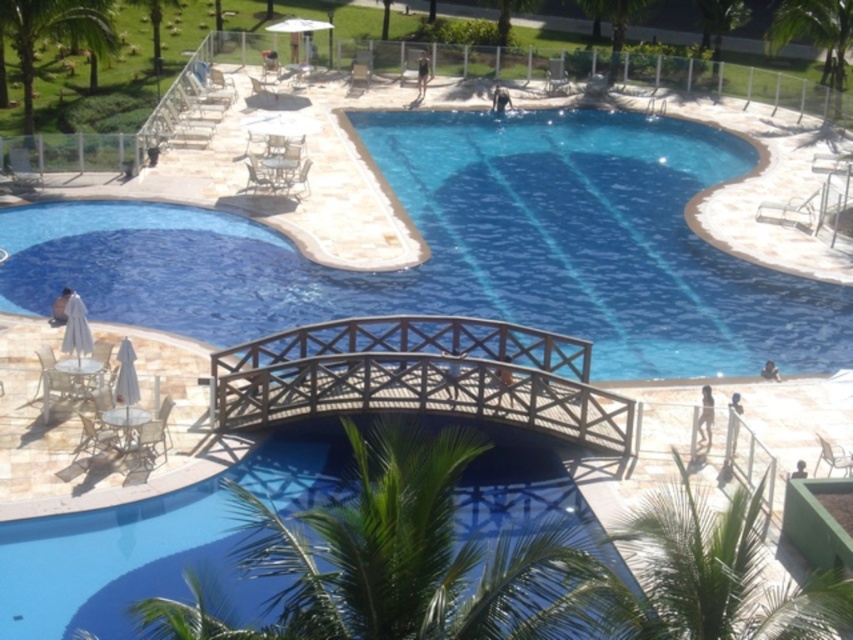
Question: Is green leafy palm tree at center further to the viewer compared to metallic silver chair at lower right?

Choices:
 (A) yes
 (B) no

Answer: (B)

Question: Among these objects, which one is farthest from the camera?

Choices:
 (A) wooden chair at upper center
 (B) green leafy palm tree at upper center
 (C) green leafy palm tree at center

Answer: (B)

Question: Which object is positioned farthest from the clear blue water at center?

Choices:
 (A) matte beige chair at lower left
 (B) green leafy palm tree at upper center

Answer: (B)

Question: Among these points, which one is farthest from the camera?

Choices:
 (A) (619, 362)
 (B) (548, 80)

Answer: (B)

Question: Is the position of green leafy palm tree at lower right more distant than that of matte beige chair at lower left?

Choices:
 (A) no
 (B) yes

Answer: (A)

Question: Is green leafy palm tree at upper right above matte beige chair at lower left?

Choices:
 (A) no
 (B) yes

Answer: (B)